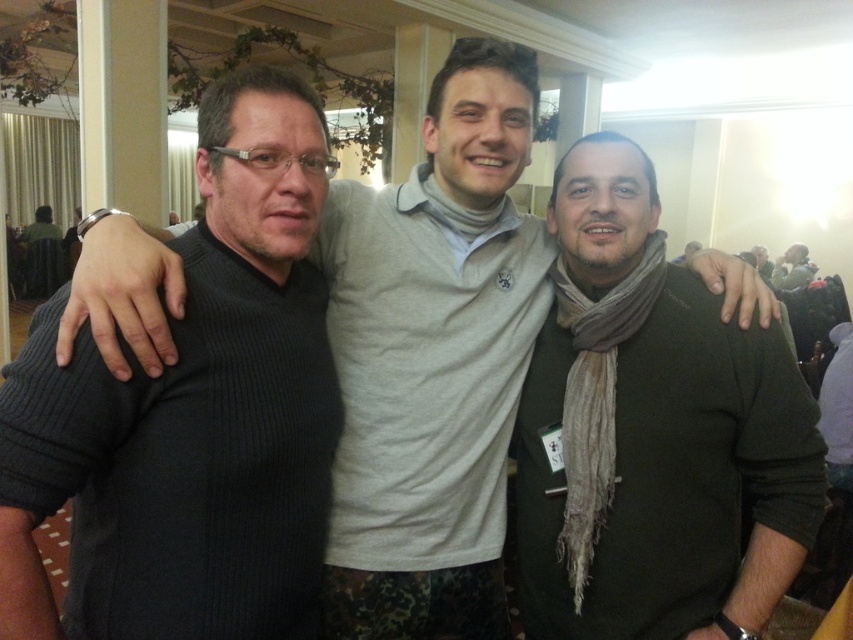
You are standing at the point marked as point [318,448]. You want to greet the three men in the scene. Which direction should you move to approach them?

Since the three men are the focal point of the image and you are at point [318,448], you should move towards the center of the image to approach them.

You are at a social event and want to greet the two men wearing ribbed sweater at left and dark green sweater at center. Which one should you approach first if you are standing to the right of both?

Result: You should approach the dark green sweater at center first because the ribbed sweater at left is to the left of dark green sweater at center, so the dark green sweater at center is closer to your position on the right.